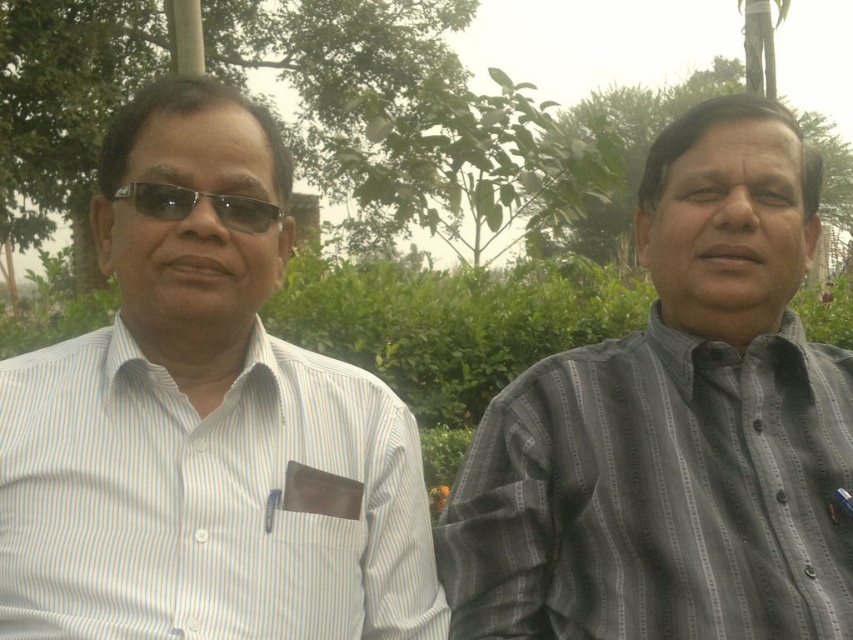
You are a photographer trying to capture a closeup of the gray striped shirt at right and the white striped shirt at left. Given that your camera can focus on objects within a 12 inch range, will you be able to capture both shirts in focus without adjusting your camera settings?

The gray striped shirt at right is 13.44 inches away from the white striped shirt at left. Since the distance between them exceeds the camera focus range of 12 inches, you won photography adjust your camera settings to ensure both shirts are in focus.

You are standing in a park and see the image. The park has a map with coordinates. Where is the gray striped shirt at right located on the map?

The gray striped shirt at right is located at coordinates point [675,428] on the map.

You are a photographer trying to capture a closeup of the black plastic glasses at left and the gray striped shirt at right. Since you want both objects in focus, you need to know which one is closer to you. Based on the scene, can you determine which object is nearer?

The gray striped shirt at right is to the right of black plastic glasses at left, so the black plastic glasses at left is closer to you.